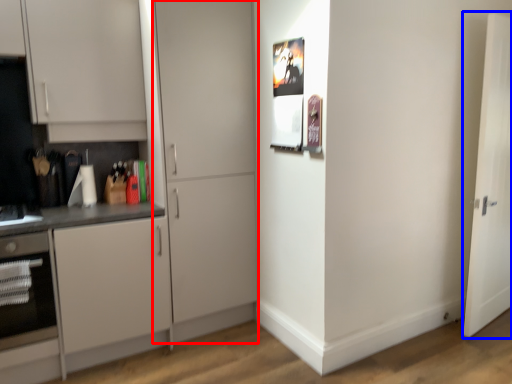
Question: Which point is closer to the camera, door (highlighted by a red box) or door (highlighted by a blue box)?

Choices:
 (A) door
 (B) door

Answer: (A)